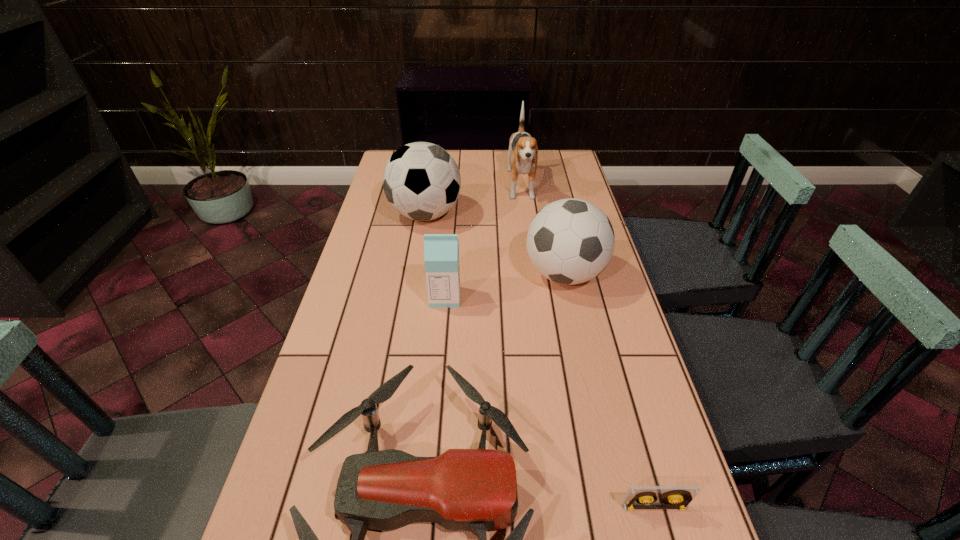
This screenshot has height=540, width=960. I want to click on free space between the puppy and the shortest object, so click(588, 347).

Where is `free space between the milk carton and the videotape`? free space between the milk carton and the videotape is located at coordinates (550, 402).

Identify the location of free area in between the left soccer ball and the nearer soccer ball. The width and height of the screenshot is (960, 540). (495, 244).

Locate which object ranks fourth in proximity to the shortest object. Please provide its 2D coordinates. Your answer should be formatted as a tuple, i.e. [(x, y)], where the tuple contains the x and y coordinates of a point satisfying the conditions above.

[(421, 180)]

I want to click on the third closest object to the left soccer ball, so (x=441, y=251).

Find the location of a particular element. Image resolution: width=960 pixels, height=540 pixels. vacant point that satisfies the following two spatial constraints: 1. at the face of the puppy; 2. on the main logo of the left soccer ball is located at coordinates (524, 214).

At what (x,y) coordinates should I click in order to perform the action: click on vacant region that satisfies the following two spatial constraints: 1. at the face of the right soccer ball; 2. on the right side of the puppy. Please return your answer as a coordinate pair (x, y). Looking at the image, I should click on (533, 274).